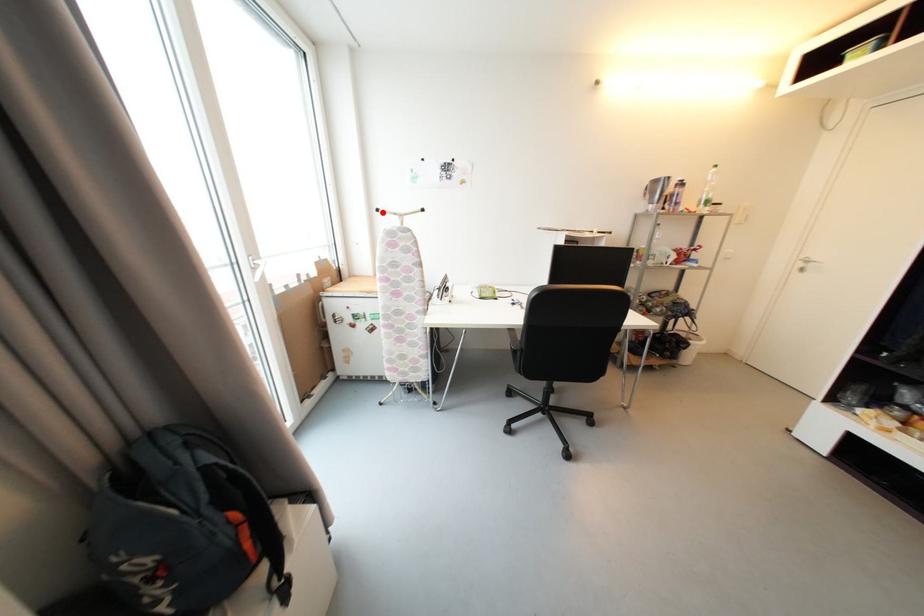
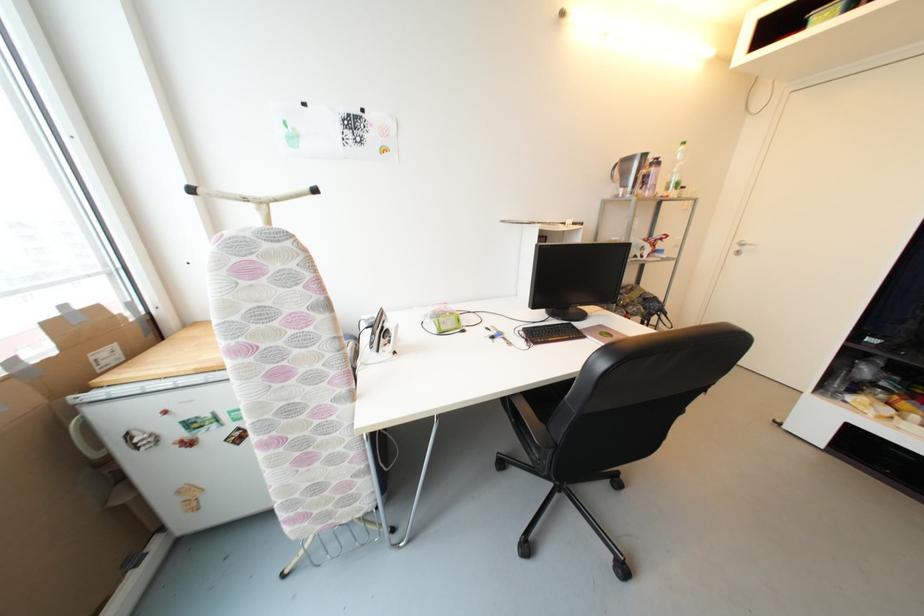
The point at the highlighted location is marked in the first image. Where is the corresponding point in the second image?

(197, 192)